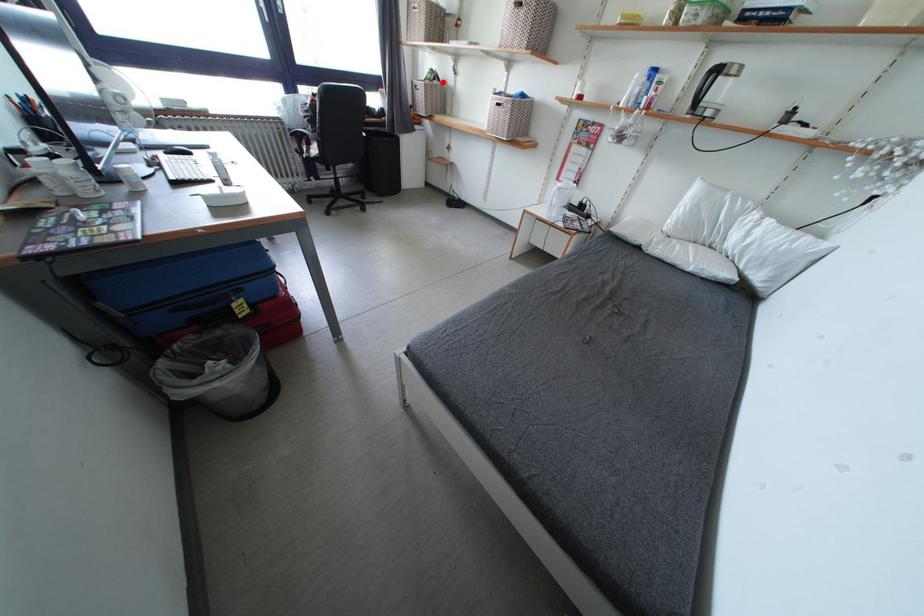
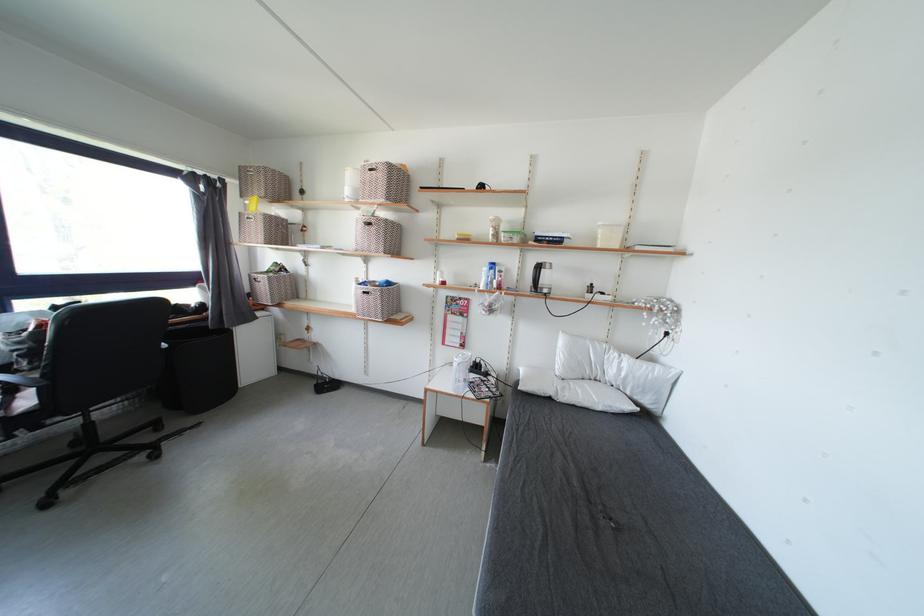
Question: I am providing you with two images of the same scene from different viewpoints. In image1, a red point is highlighted. Considering the same 3D point in image2, which of the following is correct?

Choices:
 (A) It is closer
 (B) It is farther

Answer: (B)